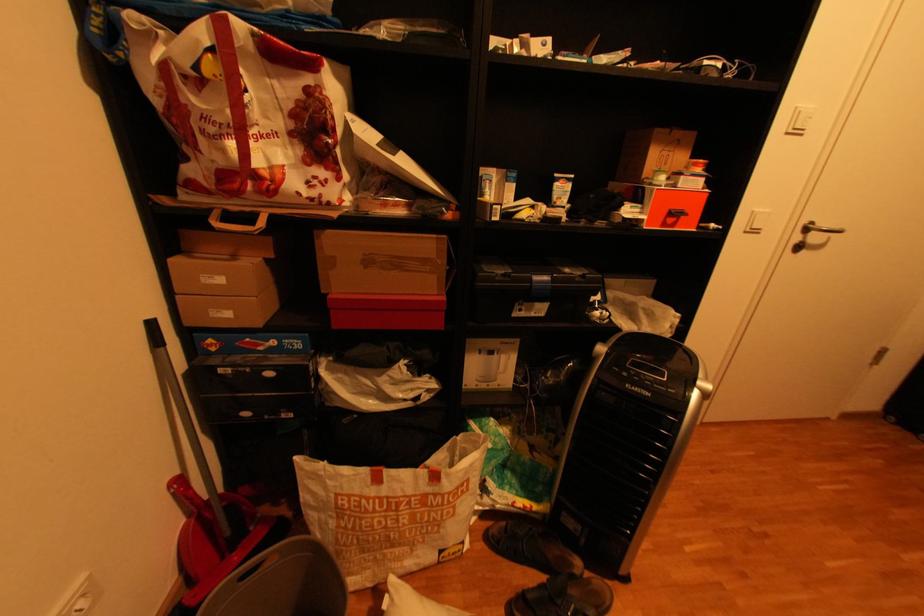
This screenshot has height=616, width=924. Describe the element at coordinates (185, 419) in the screenshot. I see `the long grey handle` at that location.